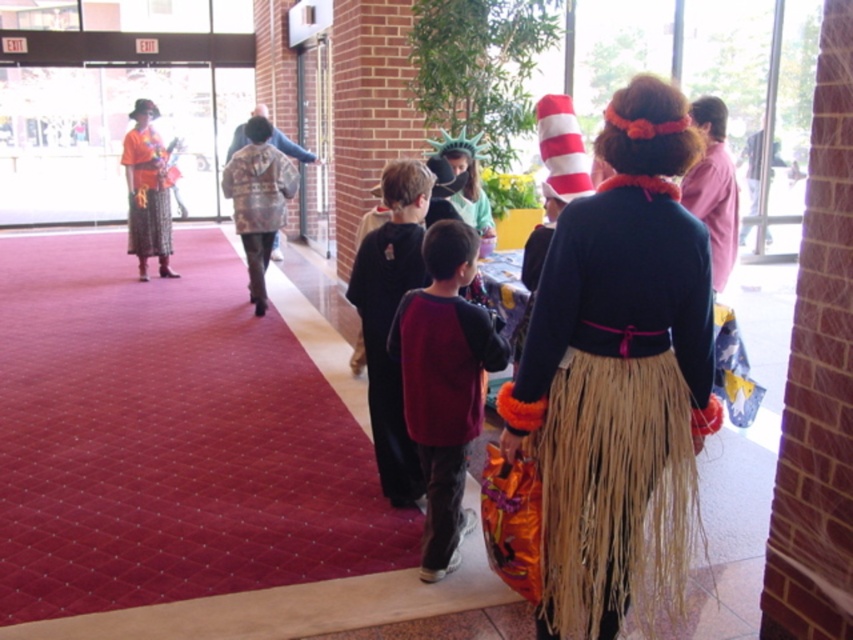
In the scene shown: Does natural straw skirt at center lie behind orange printed fabric skirt at left?

No, it is in front of orange printed fabric skirt at left.

Who is shorter, natural straw skirt at center or orange printed fabric skirt at left?

orange printed fabric skirt at left

The height and width of the screenshot is (640, 853). Describe the element at coordinates (616, 404) in the screenshot. I see `natural straw skirt at center` at that location.

Identify the location of natural straw skirt at center. (616, 404).

Is point (485, 321) closer to viewer compared to point (361, 253)?

Yes, it is in front of point (361, 253).

Is maroon fleece sweater at center further to the viewer compared to velvet maroon vest at center?

That is False.

Identify the location of maroon fleece sweater at center. (444, 384).

Where is `maroon fleece sweater at center`? maroon fleece sweater at center is located at coordinates (444, 384).

Is orange printed fabric skirt at left shorter than pink fabric shirt at upper right?

Incorrect, orange printed fabric skirt at left's height does not fall short of pink fabric shirt at upper right's.

Is orange printed fabric skirt at left positioned behind pink fabric shirt at upper right?

Yes, it is behind pink fabric shirt at upper right.

The width and height of the screenshot is (853, 640). What are the coordinates of `orange printed fabric skirt at left` in the screenshot? It's located at (148, 193).